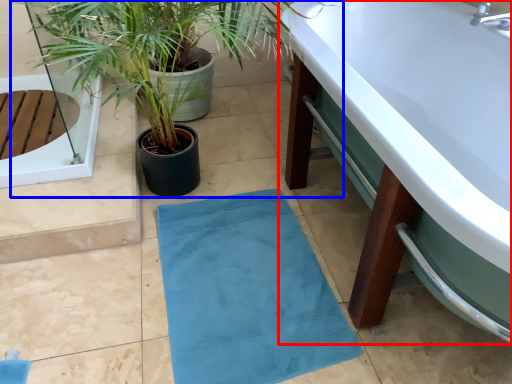
Question: Which object is closer to the camera taking this photo, bathtub (highlighted by a red box) or houseplant (highlighted by a blue box)?

Choices:
 (A) bathtub
 (B) houseplant

Answer: (A)